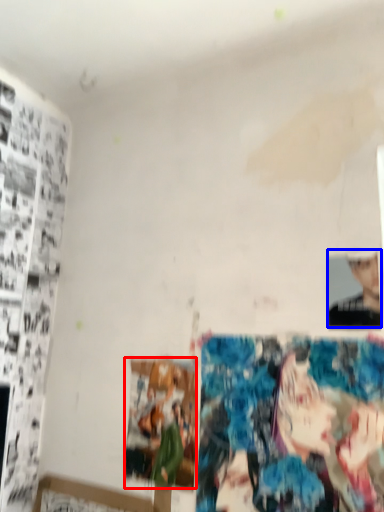
Question: Which object is further to the camera taking this photo, print (highlighted by a red box) or person (highlighted by a blue box)?

Choices:
 (A) print
 (B) person

Answer: (A)